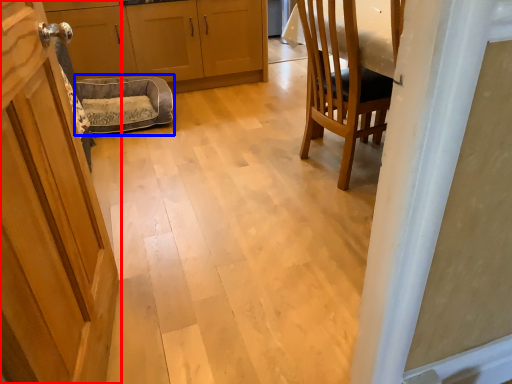
Question: Which object is closer to the camera taking this photo, door (highlighted by a red box) or dog bed (highlighted by a blue box)?

Choices:
 (A) door
 (B) dog bed

Answer: (A)